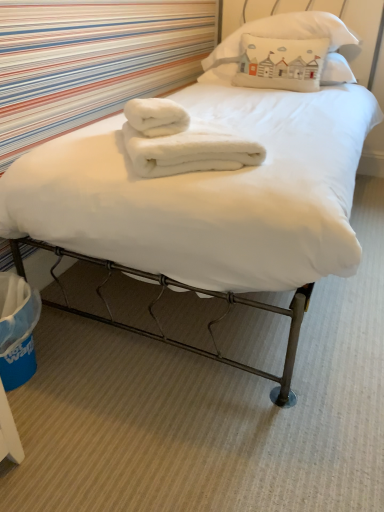
Question: From a real-world perspective, is white cotton pillow at upper center, the first pillow viewed from the top, positioned over white fluffy towel at center, which appears as the second bath towel when ordered from the bottom, based on gravity?

Choices:
 (A) no
 (B) yes

Answer: (B)

Question: From the image's perspective, is white cotton pillow at upper center, the first pillow viewed from the top, located beneath white fluffy towel at center, which appears as the second bath towel when ordered from the bottom?

Choices:
 (A) no
 (B) yes

Answer: (A)

Question: From a real-world perspective, is white cotton pillow at upper center, the first pillow viewed from the top, under white fluffy towel at center, arranged as the 1th bath towel when viewed from the top?

Choices:
 (A) no
 (B) yes

Answer: (A)

Question: Is white fluffy towel at center, arranged as the 1th bath towel when viewed from the top, a part of white cotton pillow at upper center, the first pillow viewed from the top?

Choices:
 (A) no
 (B) yes

Answer: (A)

Question: Is white cotton pillow at upper center, which ranks as the third pillow in bottom-to-top order, in contact with white fluffy towel at center, which appears as the second bath towel when ordered from the bottom?

Choices:
 (A) yes
 (B) no

Answer: (B)

Question: Considering the positions of white fluffy towel at center, which appears as the second bath towel when ordered from the bottom, and white cotton pillow at upper center, which is the second pillow from top to bottom, in the image, is white fluffy towel at center, which appears as the second bath towel when ordered from the bottom, wider or thinner than white cotton pillow at upper center, which is the second pillow from top to bottom,?

Choices:
 (A) wide
 (B) thin

Answer: (B)

Question: Is white fluffy towel at center, arranged as the 1th bath towel when viewed from the top, in front of or behind white cotton pillow at upper center, which is counted as the second pillow, starting from the bottom, in the image?

Choices:
 (A) front
 (B) behind

Answer: (A)

Question: Is white fluffy towel at center, which appears as the second bath towel when ordered from the bottom, to the left or to the right of white cotton pillow at upper center, which is the second pillow from top to bottom, in the image?

Choices:
 (A) right
 (B) left

Answer: (B)

Question: From a real-world perspective, is white fluffy towel at center, which appears as the second bath towel when ordered from the bottom, physically located above or below white cotton pillow at upper center, which is the second pillow from top to bottom?

Choices:
 (A) below
 (B) above

Answer: (B)

Question: Considering the positions of white cotton pillow at upper center, which ranks as the third pillow in bottom-to-top order, and white cotton pillow at upper center, the 1th pillow positioned from the bottom, in the image, is white cotton pillow at upper center, which ranks as the third pillow in bottom-to-top order, wider or thinner than white cotton pillow at upper center, the 1th pillow positioned from the bottom,?

Choices:
 (A) wide
 (B) thin

Answer: (A)

Question: From the image's perspective, is white cotton pillow at upper center, which ranks as the third pillow in bottom-to-top order, positioned above or below white cotton pillow at upper center, the third pillow viewed from the top?

Choices:
 (A) above
 (B) below

Answer: (A)

Question: Is white cotton pillow at upper center, which ranks as the third pillow in bottom-to-top order, inside the boundaries of white cotton pillow at upper center, the 1th pillow positioned from the bottom, or outside?

Choices:
 (A) inside
 (B) outside

Answer: (B)

Question: Is point (314, 28) closer or farther from the camera than point (288, 76)?

Choices:
 (A) farther
 (B) closer

Answer: (B)

Question: From the image's perspective, relative to white fluffy towel at center, which appears as the second bath towel when ordered from the bottom, is white cotton pillow at upper center, the 1th pillow positioned from the bottom, above or below?

Choices:
 (A) above
 (B) below

Answer: (A)

Question: From a real-world perspective, is white cotton pillow at upper center, the third pillow viewed from the top, physically located above or below white fluffy towel at center, which appears as the second bath towel when ordered from the bottom?

Choices:
 (A) below
 (B) above

Answer: (B)